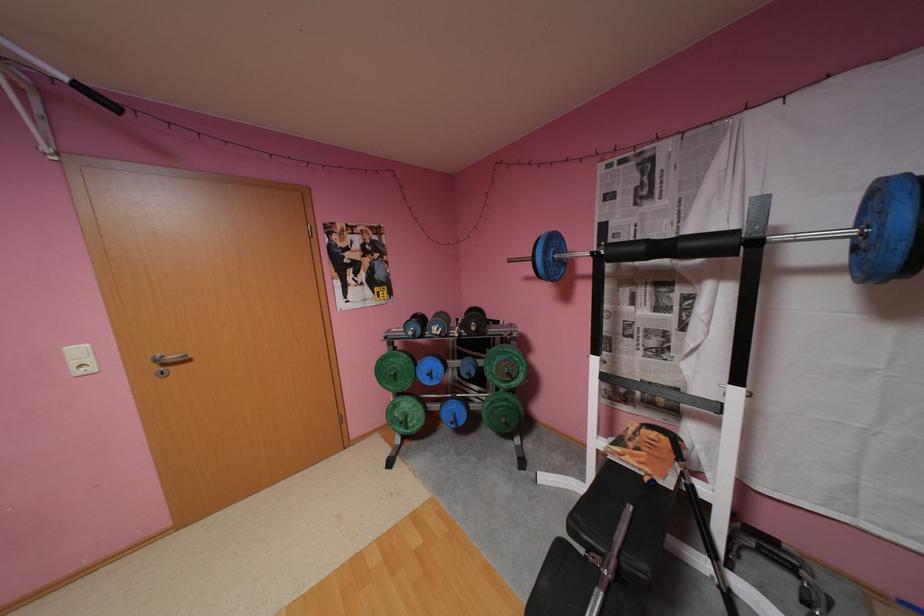
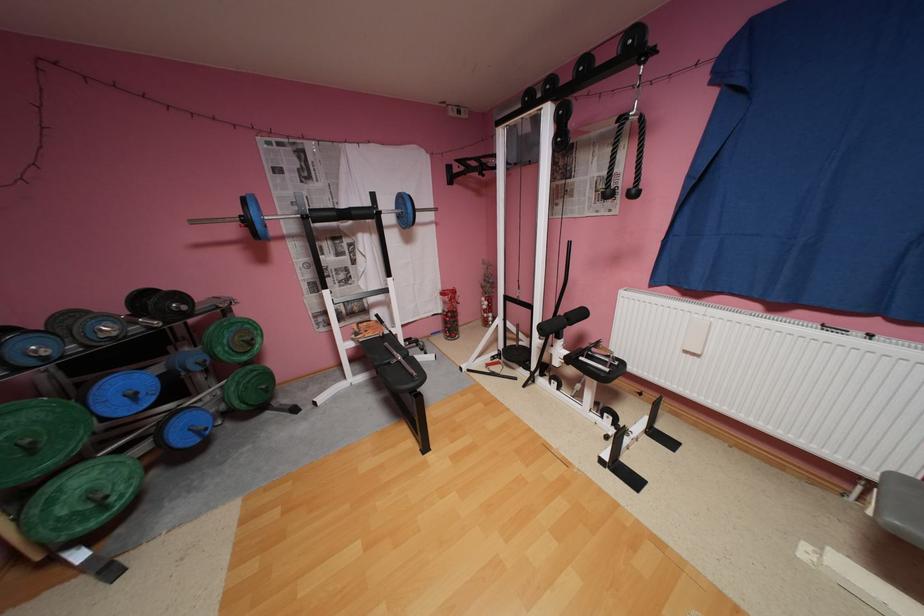
Locate, in the second image, the point that corresponds to the point at 439,374 in the first image.

(142, 395)